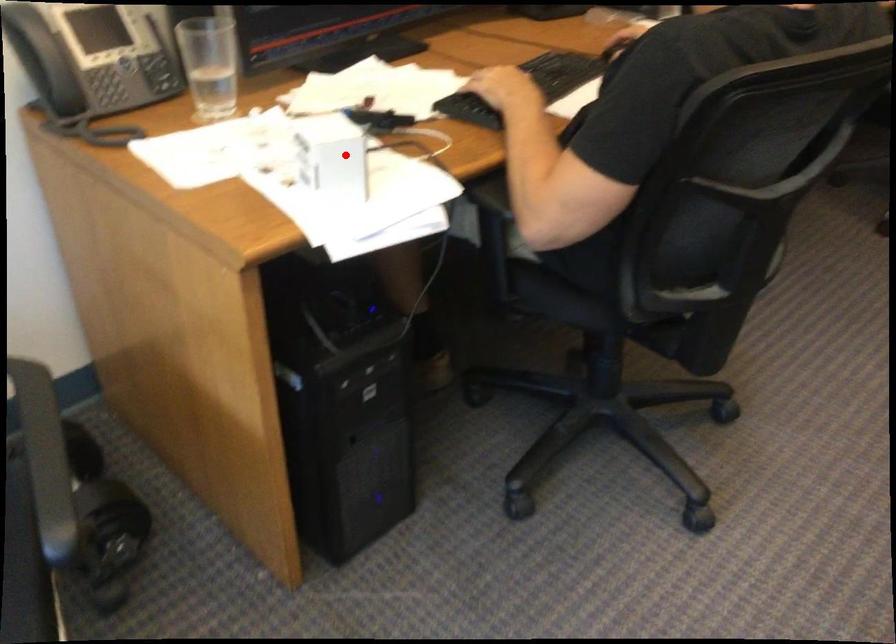
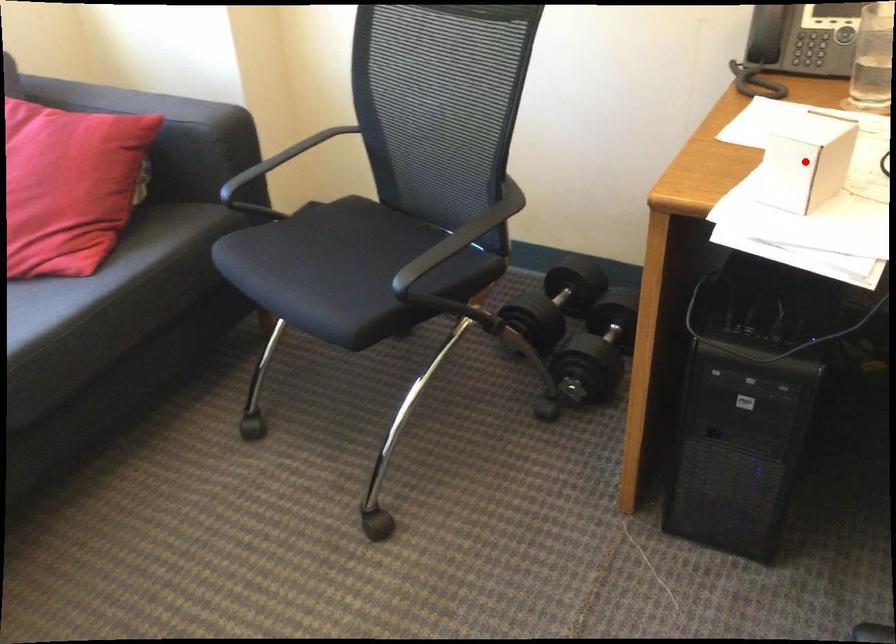
I am providing you with two images of the same scene from different viewpoints. A red point is marked on the first image and another point is marked on the second image. Does the point marked in image1 correspond to the same location as the one in image2?

Yes